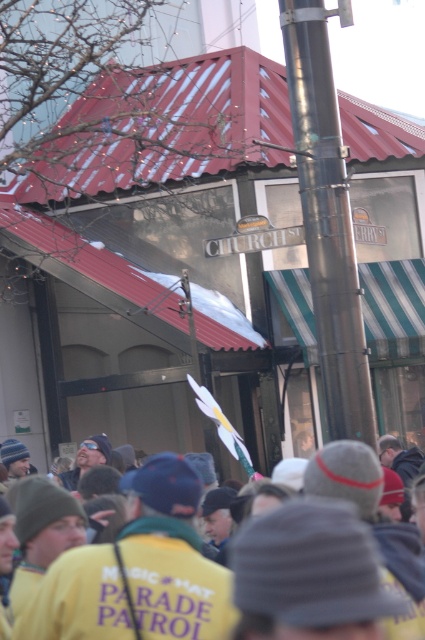
Who is more forward, (156,496) or (300,58)?

Point (156,496) is more forward.

Is yellow fabric at center wider than polished metal pole at center?

Yes.

Locate an element on the screen. This screenshot has height=640, width=425. yellow fabric at center is located at coordinates point(172,556).